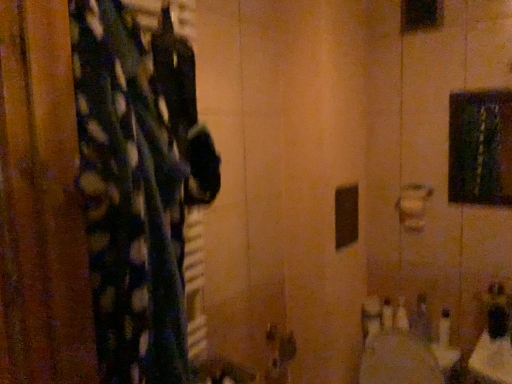
Image resolution: width=512 pixels, height=384 pixels. What do you see at coordinates (401, 316) in the screenshot? I see `white plastic bottles at lower right, the second toiletry viewed from the right` at bounding box center [401, 316].

The height and width of the screenshot is (384, 512). What are the coordinates of `white plastic bottles at lower right, marked as the 1th toiletry in a left-to-right arrangement` in the screenshot? It's located at (401, 316).

At what (x,y) coordinates should I click in order to perform the action: click on metallic silver soap at lower right, the 2th toiletry positioned from the left. Please return your answer as a coordinate pair (x, y). This screenshot has height=384, width=512. Looking at the image, I should click on (421, 319).

This screenshot has height=384, width=512. What are the coordinates of `white plastic bottles at lower right, marked as the 1th toiletry in a left-to-right arrangement` in the screenshot? It's located at (401, 316).

Locate an element on the screen. The height and width of the screenshot is (384, 512). curtain above the metallic silver soap at lower right, which appears as the 1th toiletry when viewed from the right (from the image's perspective) is located at coordinates (137, 187).

Between metallic silver soap at lower right, which appears as the 1th toiletry when viewed from the right, and fluffy polka dot fabric at left, which one appears on the right side from the viewer's perspective?

From the viewer's perspective, metallic silver soap at lower right, which appears as the 1th toiletry when viewed from the right, appears more on the right side.

Can you confirm if metallic silver soap at lower right, which appears as the 1th toiletry when viewed from the right, is smaller than fluffy polka dot fabric at left?

Yes, metallic silver soap at lower right, which appears as the 1th toiletry when viewed from the right, is smaller than fluffy polka dot fabric at left.

Is white plastic bottles at lower right, the second toiletry viewed from the right, thinner than metallic silver soap at lower right, the 2th toiletry positioned from the left?

In fact, white plastic bottles at lower right, the second toiletry viewed from the right, might be wider than metallic silver soap at lower right, the 2th toiletry positioned from the left.

Does white plastic bottles at lower right, marked as the 1th toiletry in a left-to-right arrangement, lie behind metallic silver soap at lower right, the 2th toiletry positioned from the left?

Yes, white plastic bottles at lower right, marked as the 1th toiletry in a left-to-right arrangement, is behind metallic silver soap at lower right, the 2th toiletry positioned from the left.

In the scene shown: How many degrees apart are the facing directions of white plastic bottles at lower right, the second toiletry viewed from the right, and metallic silver soap at lower right, the 2th toiletry positioned from the left?

There is a 13.7-degree angle between the facing directions of white plastic bottles at lower right, the second toiletry viewed from the right, and metallic silver soap at lower right, the 2th toiletry positioned from the left.

Considering the sizes of objects white plastic bottles at lower right, marked as the 1th toiletry in a left-to-right arrangement, and metallic silver soap at lower right, the 2th toiletry positioned from the left, in the image provided, who is bigger, white plastic bottles at lower right, marked as the 1th toiletry in a left-to-right arrangement, or metallic silver soap at lower right, the 2th toiletry positioned from the left,?

metallic silver soap at lower right, the 2th toiletry positioned from the left.

Is metallic silver soap at lower right, which appears as the 1th toiletry when viewed from the right, smaller than white plastic bottles at lower right, the second toiletry viewed from the right?

No.

From a real-world perspective, relative to white plastic bottles at lower right, the second toiletry viewed from the right, is metallic silver soap at lower right, the 2th toiletry positioned from the left, vertically above or below?

metallic silver soap at lower right, the 2th toiletry positioned from the left, is above white plastic bottles at lower right, the second toiletry viewed from the right.

Which is behind, point (426, 331) or point (407, 315)?

The point (407, 315) is farther.

Can you confirm if metallic silver soap at lower right, the 2th toiletry positioned from the left, is thinner than white plastic bottles at lower right, the second toiletry viewed from the right?

Indeed, metallic silver soap at lower right, the 2th toiletry positioned from the left, has a lesser width compared to white plastic bottles at lower right, the second toiletry viewed from the right.

Which of these two, fluffy polka dot fabric at left or metallic silver soap at lower right, the 2th toiletry positioned from the left, is thinner?

metallic silver soap at lower right, the 2th toiletry positioned from the left.

Who is shorter, fluffy polka dot fabric at left or metallic silver soap at lower right, the 2th toiletry positioned from the left?

With less height is metallic silver soap at lower right, the 2th toiletry positioned from the left.

Is fluffy polka dot fabric at left bigger or smaller than metallic silver soap at lower right, which appears as the 1th toiletry when viewed from the right?

Clearly, fluffy polka dot fabric at left is larger in size than metallic silver soap at lower right, which appears as the 1th toiletry when viewed from the right.

In the image, is fluffy polka dot fabric at left on the left side or the right side of metallic silver soap at lower right, the 2th toiletry positioned from the left?

In the image, fluffy polka dot fabric at left appears on the left side of metallic silver soap at lower right, the 2th toiletry positioned from the left.

From the image's perspective, is fluffy polka dot fabric at left below white plastic bottles at lower right, the second toiletry viewed from the right?

No, from the image's perspective, fluffy polka dot fabric at left is not below white plastic bottles at lower right, the second toiletry viewed from the right.

Is fluffy polka dot fabric at left facing away from white plastic bottles at lower right, marked as the 1th toiletry in a left-to-right arrangement?

No.

In the image, is fluffy polka dot fabric at left positioned in front of or behind white plastic bottles at lower right, the second toiletry viewed from the right?

In the image, fluffy polka dot fabric at left appears in front of white plastic bottles at lower right, the second toiletry viewed from the right.

What's the angular difference between fluffy polka dot fabric at left and white plastic bottles at lower right, the second toiletry viewed from the right,'s facing directions?

The angular difference between fluffy polka dot fabric at left and white plastic bottles at lower right, the second toiletry viewed from the right, is 165 degrees.

From the picture: Is white plastic bottles at lower right, marked as the 1th toiletry in a left-to-right arrangement, thinner than fluffy polka dot fabric at left?

Indeed, white plastic bottles at lower right, marked as the 1th toiletry in a left-to-right arrangement, has a lesser width compared to fluffy polka dot fabric at left.

Relative to fluffy polka dot fabric at left, is white plastic bottles at lower right, marked as the 1th toiletry in a left-to-right arrangement, in front or behind?

Visually, white plastic bottles at lower right, marked as the 1th toiletry in a left-to-right arrangement, is located behind fluffy polka dot fabric at left.

Who is taller, white plastic bottles at lower right, the second toiletry viewed from the right, or fluffy polka dot fabric at left?

fluffy polka dot fabric at left.

Which of these two, white plastic bottles at lower right, the second toiletry viewed from the right, or fluffy polka dot fabric at left, is smaller?

Smaller between the two is white plastic bottles at lower right, the second toiletry viewed from the right.

Identify the location of curtain in front of the metallic silver soap at lower right, the 2th toiletry positioned from the left. (137, 187).

Identify the location of toiletry that appears above the white plastic bottles at lower right, the second toiletry viewed from the right (from the image's perspective). (421, 319).

Which object lies further to the anchor point fluffy polka dot fabric at left, white plastic bottles at lower right, the second toiletry viewed from the right, or metallic silver soap at lower right, the 2th toiletry positioned from the left?

white plastic bottles at lower right, the second toiletry viewed from the right, lies further to fluffy polka dot fabric at left than the other object.

Which object lies nearer to the anchor point metallic silver soap at lower right, which appears as the 1th toiletry when viewed from the right, white plastic bottles at lower right, the second toiletry viewed from the right, or fluffy polka dot fabric at left?

The object closer to metallic silver soap at lower right, which appears as the 1th toiletry when viewed from the right, is white plastic bottles at lower right, the second toiletry viewed from the right.

From the picture: When comparing their distances from fluffy polka dot fabric at left, does metallic silver soap at lower right, which appears as the 1th toiletry when viewed from the right, or white plastic bottles at lower right, marked as the 1th toiletry in a left-to-right arrangement, seem further?

white plastic bottles at lower right, marked as the 1th toiletry in a left-to-right arrangement, is positioned further to the anchor fluffy polka dot fabric at left.

Based on their spatial positions, is fluffy polka dot fabric at left or metallic silver soap at lower right, which appears as the 1th toiletry when viewed from the right, further from white plastic bottles at lower right, marked as the 1th toiletry in a left-to-right arrangement?

fluffy polka dot fabric at left.

Looking at the image, which one is located closer to white plastic bottles at lower right, the second toiletry viewed from the right, metallic silver soap at lower right, which appears as the 1th toiletry when viewed from the right, or fluffy polka dot fabric at left?

metallic silver soap at lower right, which appears as the 1th toiletry when viewed from the right, is closer to white plastic bottles at lower right, the second toiletry viewed from the right.

Estimate the real-world distances between objects in this image. Which object is further from metallic silver soap at lower right, which appears as the 1th toiletry when viewed from the right, fluffy polka dot fabric at left or white plastic bottles at lower right, marked as the 1th toiletry in a left-to-right arrangement?

fluffy polka dot fabric at left is positioned further to the anchor metallic silver soap at lower right, which appears as the 1th toiletry when viewed from the right.

At what (x,y) coordinates should I click in order to perform the action: click on toiletry positioned between fluffy polka dot fabric at left and white plastic bottles at lower right, the second toiletry viewed from the right, from near to far. Please return your answer as a coordinate pair (x, y). Looking at the image, I should click on (421, 319).